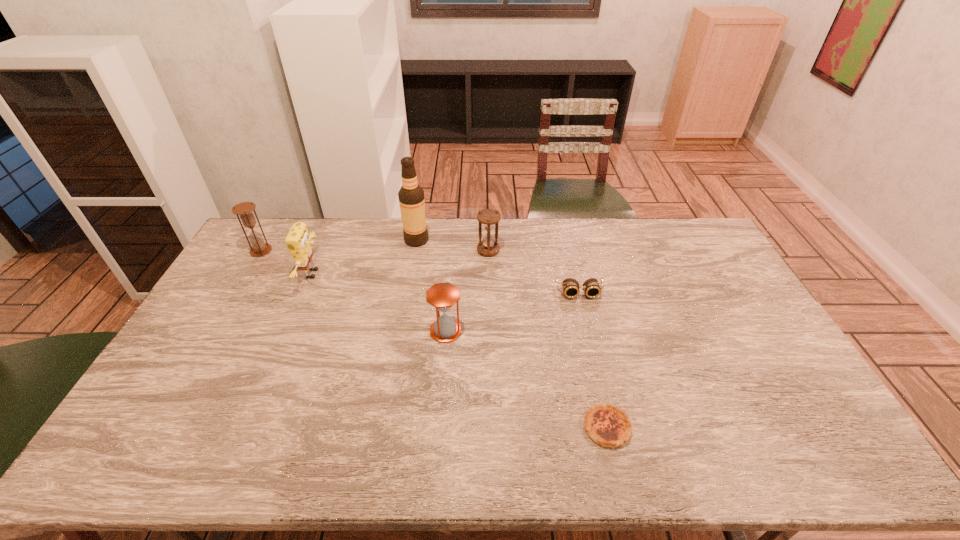
What are the coordinates of `the tallest object` in the screenshot? It's located at (411, 196).

I want to click on alcohol, so click(x=411, y=196).

Where is `the leftmost hourglass`? This screenshot has width=960, height=540. the leftmost hourglass is located at coordinates (259, 248).

Identify the location of the second object from left to right. This screenshot has height=540, width=960. (298, 242).

Find the location of a particular element. This screenshot has width=960, height=540. the fifth object from left to right is located at coordinates (488, 218).

The image size is (960, 540). Identify the location of the fourth object from left to right. (442, 296).

What are the coordinates of `the sixth farthest object` in the screenshot? It's located at (442, 296).

Identify the location of goggles. (570, 286).

At what (x,y) coordinates should I click in order to perform the action: click on the shortest object. Please return your answer as a coordinate pair (x, y). Looking at the image, I should click on (609, 426).

I want to click on quiche, so click(x=609, y=426).